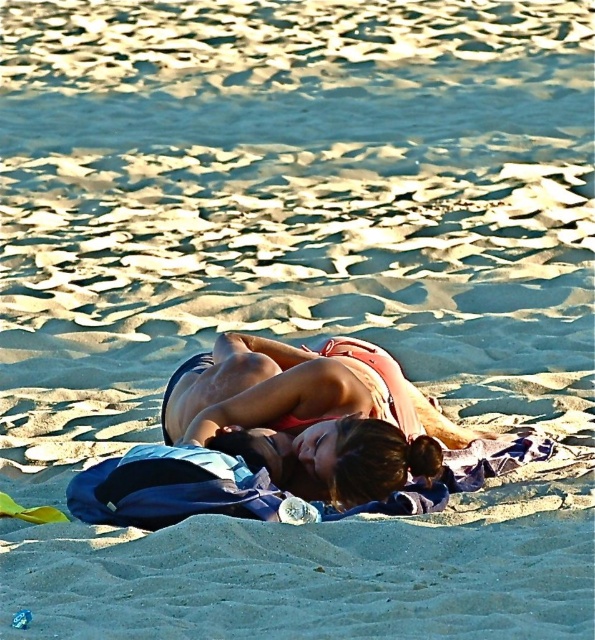
Does pink fabric bikini at center have a greater width compared to matte pink bikini at center?

Yes.

Does pink fabric bikini at center appear on the left side of matte pink bikini at center?

In fact, pink fabric bikini at center is to the right of matte pink bikini at center.

Describe the element at coordinates (311, 413) in the screenshot. The height and width of the screenshot is (640, 595). I see `pink fabric bikini at center` at that location.

The image size is (595, 640). What are the coordinates of `pink fabric bikini at center` in the screenshot? It's located at (311, 413).